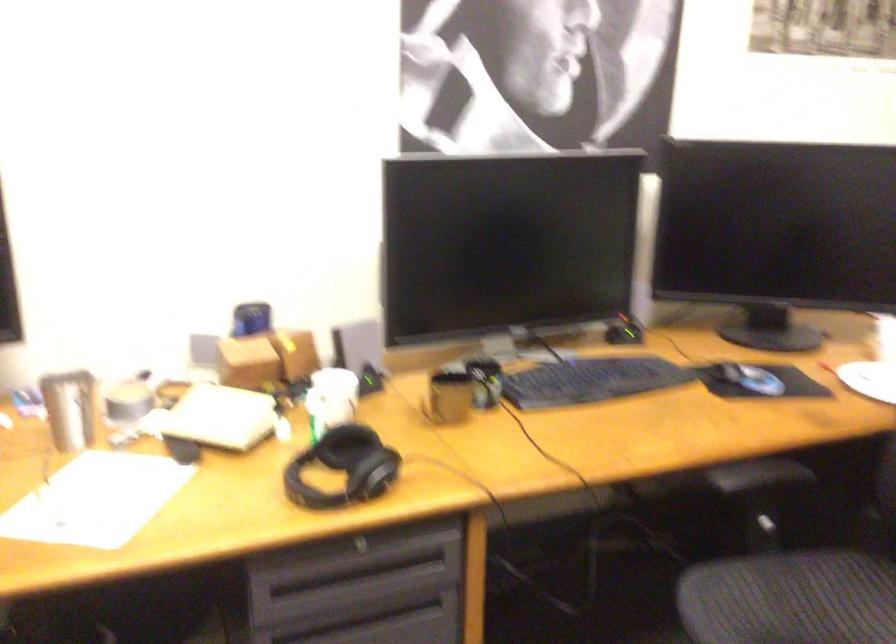
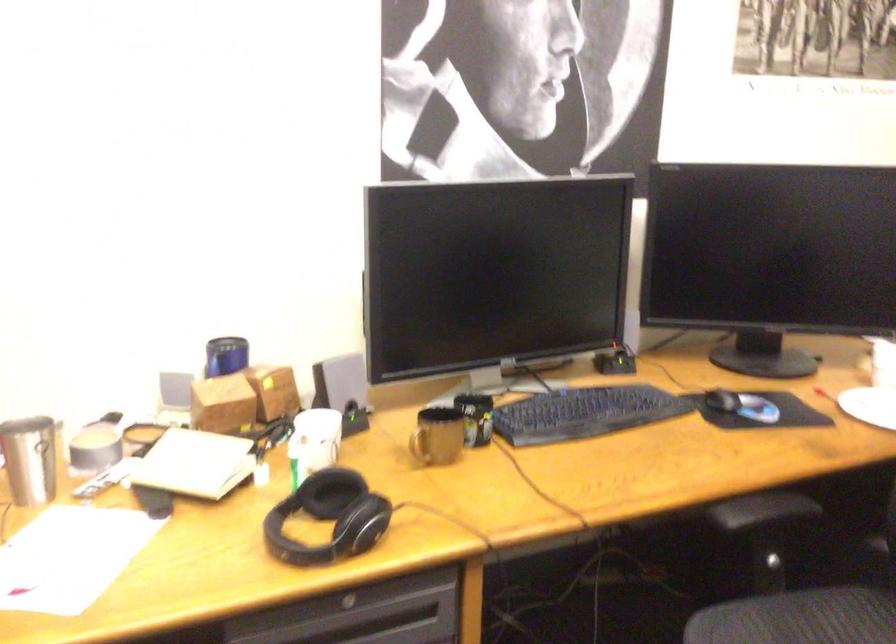
Find the pixel in the second image that matches [367,377] in the first image.

(352, 413)